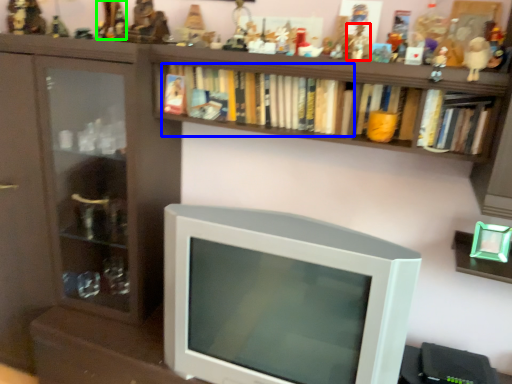
Question: Estimate the real-world distances between objects in this image. Which object is farther from toy (highlighted by a red box), book (highlighted by a blue box) or toy (highlighted by a green box)?

Choices:
 (A) book
 (B) toy

Answer: (B)